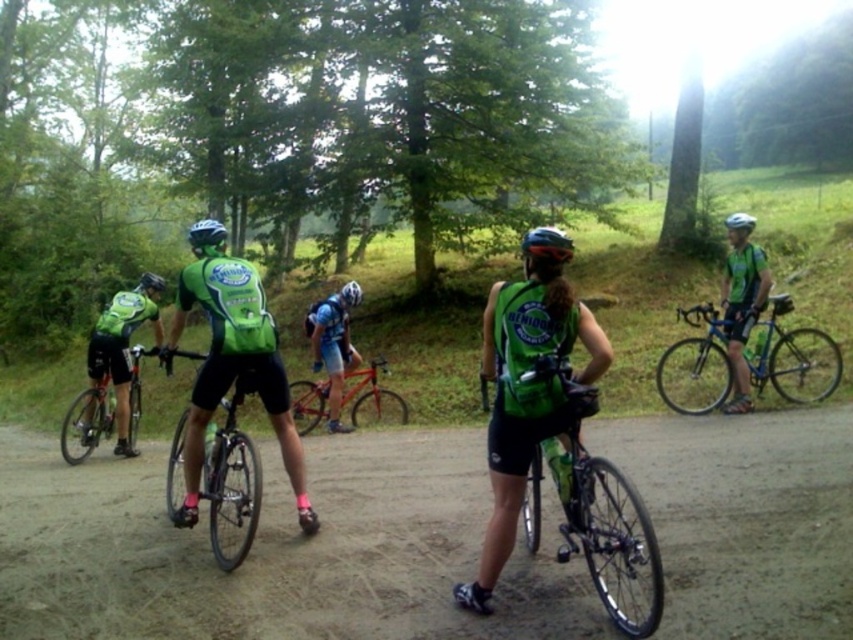
You are a cyclist in the group and want to navigate between two points marked on your map. The first point is at point [105,401] and the second is at point [546,234]. Which point is closer to you as you stand on the dirt path?

Point [105,401] is closer to you because it is further to the viewer than point [546,234].

You are a photographer positioned at the center of the dirt path. You want to capture a photo of the shiny silver bicycle at left. Based on its position, will the bicycle be in the foreground or background of your photo?

The shiny silver bicycle at left is located at point [88,420], which places it closer to the camera. Therefore, it will be in the foreground of the photo.